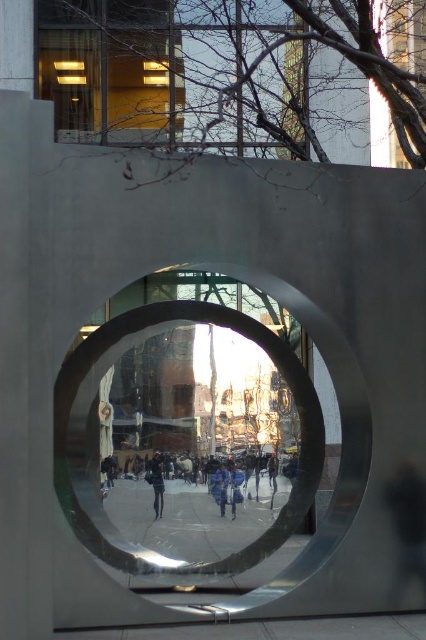
Question: Can you confirm if polished silver circle at center is bigger than dark gray fabric at center?

Choices:
 (A) yes
 (B) no

Answer: (A)

Question: Is the position of polished silver circle at center less distant than that of dark gray fabric at center?

Choices:
 (A) yes
 (B) no

Answer: (A)

Question: Can you confirm if polished silver circle at center is positioned to the left of dark gray fabric at center?

Choices:
 (A) yes
 (B) no

Answer: (B)